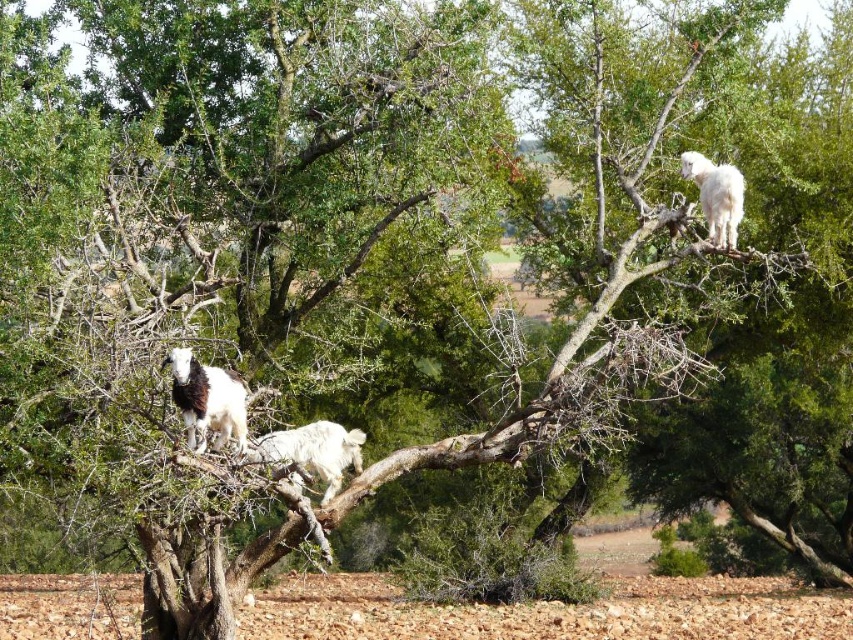
You are standing at the origin point in the image. There is a white woolen goat at left located at point [206,401]. Can you determine the direction of the white woolen goat at left relative to your position?

The white woolen goat at left is located at point [206,401], which is to the right and slightly above your current position at the origin.

You are a photographer trying to capture a clear shot of both the white woolen goat at left and the white woolen goat at upper right. Which goat would appear closer to the camera in your photo?

The white woolen goat at left appears closer to the camera because it is positioned in front of the white woolen goat at upper right.

You are standing at the base of the argan tree where the three goats are perched. You notice a point marked at coordinates (553,605). What is located at this point?

The point at coordinates (553,605) is a dirt field at lower center.